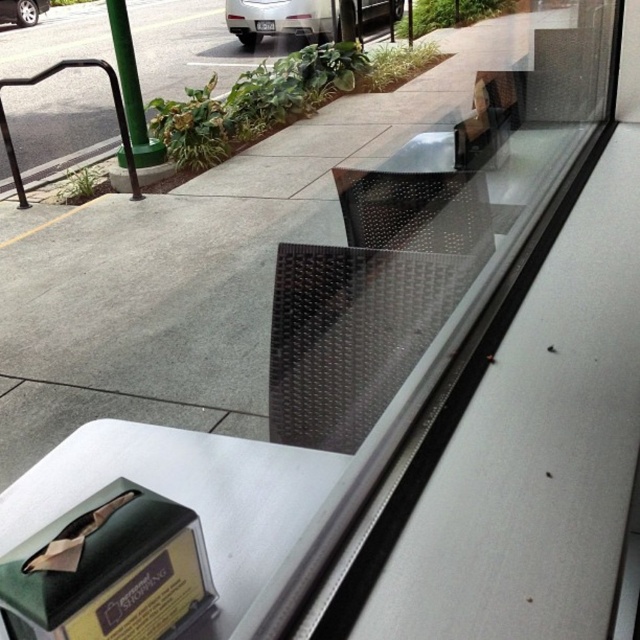
Which is more to the right, silver metallic car at upper center or silver metallic car wheel at upper left?

From the viewer's perspective, silver metallic car at upper center appears more on the right side.

Can you confirm if silver metallic car at upper center is thinner than silver metallic car wheel at upper left?

No, silver metallic car at upper center is not thinner than silver metallic car wheel at upper left.

Which is in front, point (305, 1) or point (20, 6)?

Point (305, 1) is more forward.

Locate an element on the screen. silver metallic car at upper center is located at coordinates (282, 19).

Measure the distance between green metal rail at upper left and camera.

13.51 feet

Is point (124, 124) behind point (13, 8)?

No, (124, 124) is in front of (13, 8).

What do you see at coordinates (113, 99) in the screenshot? This screenshot has height=640, width=640. I see `green metal rail at upper left` at bounding box center [113, 99].

This screenshot has height=640, width=640. I want to click on green metal rail at upper left, so click(113, 99).

Looking at this image, can you confirm if silver metallic car at upper center is positioned to the right of green metal rail at upper left?

Correct, you'll find silver metallic car at upper center to the right of green metal rail at upper left.

Between silver metallic car at upper center and green metal rail at upper left, which one appears on the right side from the viewer's perspective?

Result: silver metallic car at upper center is more to the right.

Between point (236, 20) and point (16, 157), which one is positioned behind?

The point (236, 20) is behind.

You are a GUI agent. You are given a task and a screenshot of the screen. Output one action in this format:
    pyautogui.click(x=<x>, y=<y>)
    Task: Click on the silver metallic car at upper center
    This screenshot has height=640, width=640.
    Given the screenshot: What is the action you would take?
    pyautogui.click(x=282, y=19)